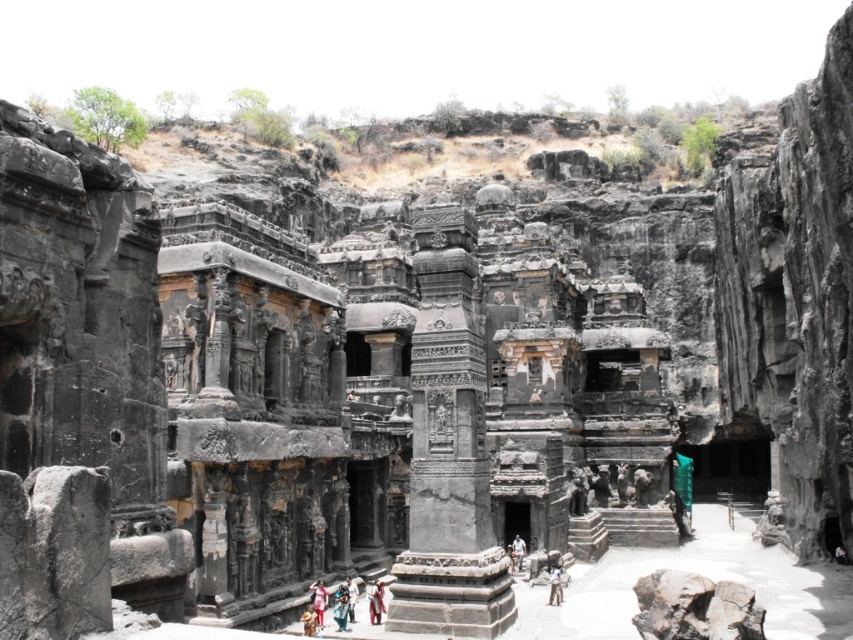
Question: Which of the following is the closest to the observer?

Choices:
 (A) (514, 545)
 (B) (375, 612)
 (C) (344, 616)

Answer: (C)

Question: Can you confirm if red fabric cloth at center is wider than light brown fabric person at center?

Choices:
 (A) no
 (B) yes

Answer: (B)

Question: Which point appears closest to the camera in this image?

Choices:
 (A) (316, 593)
 (B) (380, 582)
 (C) (519, 548)
 (D) (550, 600)

Answer: (A)

Question: Does blue fabric person at center appear on the left side of white cotton shirt at center?

Choices:
 (A) yes
 (B) no

Answer: (B)

Question: Does red fabric cloth at center have a greater width compared to light brown leather jacket at center?

Choices:
 (A) yes
 (B) no

Answer: (B)

Question: Which point appears farthest from the camera in this image?

Choices:
 (A) click(x=519, y=547)
 (B) click(x=379, y=592)
 (C) click(x=337, y=614)
 (D) click(x=561, y=600)

Answer: (A)